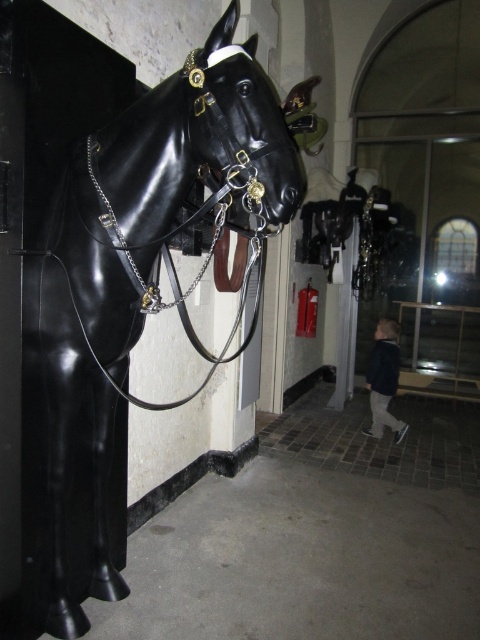
You are an artist standing in the museum and want to sketch both the dark blue jacket at lower right and the glossy black horse head at center. Which object should you sketch first if you want to start with the larger one?

The dark blue jacket at lower right is bigger than the glossy black horse head at center, so you should sketch the dark blue jacket at lower right first.

You are a visitor in the museum and want to take a photo of both the glossy black horse at left and the glossy black horse head at center. If your camera can capture objects within a 12 feet range, will both subjects be in the frame?

The glossy black horse at left is 11.55 feet away from the glossy black horse head at center. Since the camera can capture up to 12 feet, both subjects are within the range and will be in the frame.

You are an art curator examining the exhibit layout. You need to determine the spatial relationship between the glossy black horse at left and the black leather bridle at center. Which object is positioned lower in the image?

The glossy black horse at left is positioned below the black leather bridle at center, so it is lower in the image.